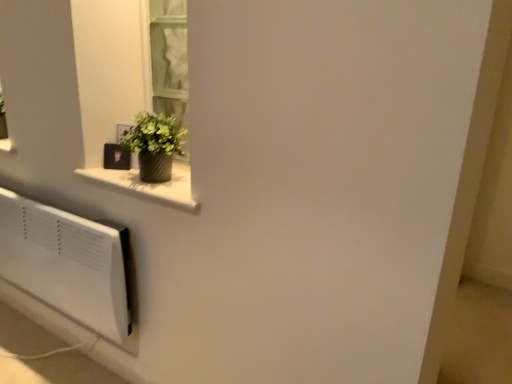
Question: Does green textured vase at upper left touch textured gray vase at upper left?

Choices:
 (A) no
 (B) yes

Answer: (B)

Question: Can you confirm if green textured vase at upper left is positioned to the right of textured gray vase at upper left?

Choices:
 (A) no
 (B) yes

Answer: (A)

Question: Would you consider green textured vase at upper left to be distant from textured gray vase at upper left?

Choices:
 (A) yes
 (B) no

Answer: (B)

Question: Does green textured vase at upper left have a smaller size compared to textured gray vase at upper left?

Choices:
 (A) yes
 (B) no

Answer: (B)

Question: Does green textured vase at upper left have a greater width compared to textured gray vase at upper left?

Choices:
 (A) no
 (B) yes

Answer: (A)

Question: Does green textured vase at upper left come in front of textured gray vase at upper left?

Choices:
 (A) yes
 (B) no

Answer: (B)

Question: Is textured gray vase at upper left wider than green textured vase at upper left?

Choices:
 (A) yes
 (B) no

Answer: (A)

Question: Is textured gray vase at upper left smaller than green textured vase at upper left?

Choices:
 (A) no
 (B) yes

Answer: (B)

Question: Would you say textured gray vase at upper left is outside green textured vase at upper left?

Choices:
 (A) yes
 (B) no

Answer: (A)

Question: Is the position of textured gray vase at upper left less distant than that of green textured vase at upper left?

Choices:
 (A) yes
 (B) no

Answer: (A)

Question: Is textured gray vase at upper left next to green textured vase at upper left and touching it?

Choices:
 (A) no
 (B) yes

Answer: (B)

Question: Does textured gray vase at upper left appear on the left side of green textured vase at upper left?

Choices:
 (A) yes
 (B) no

Answer: (B)

Question: In the image, is textured gray vase at upper left positioned in front of or behind green textured vase at upper left?

Choices:
 (A) front
 (B) behind

Answer: (A)